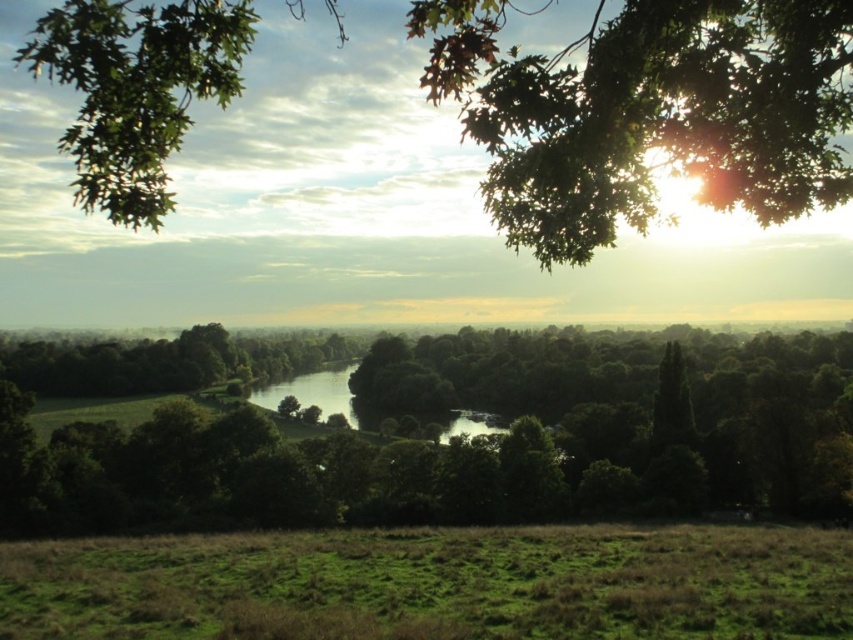
You are standing in the serene landscape scene. You see two points marked in the image. Which point is closer to you, point (544, 221) or point (772, 577)?

Point (544, 221) is closer to you because it is in front of point (772, 577).